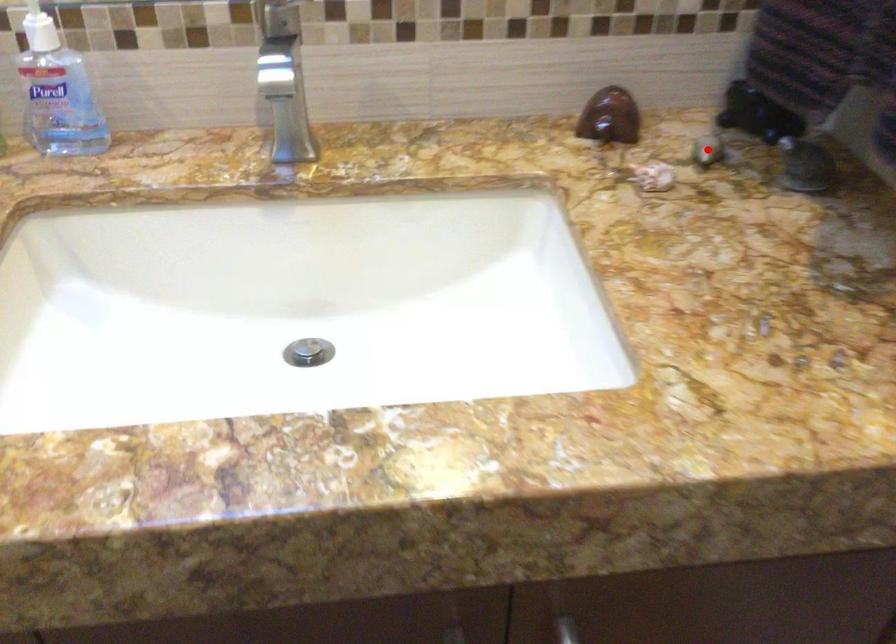
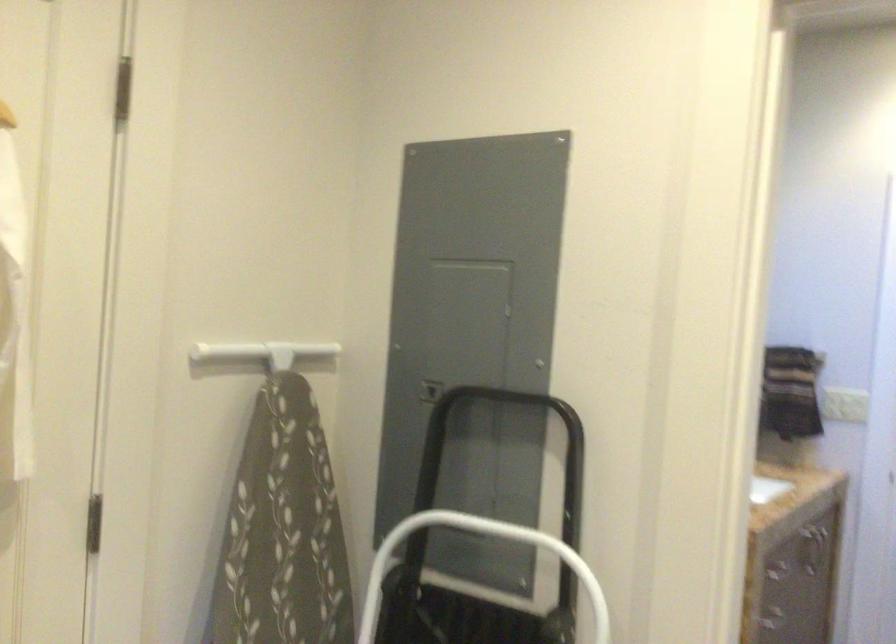
Question: I am providing you with two images of the same scene from different viewpoints. A red point is marked on the first image. Can you still see the location of the red point in image 2?

Choices:
 (A) Yes
 (B) No

Answer: (B)